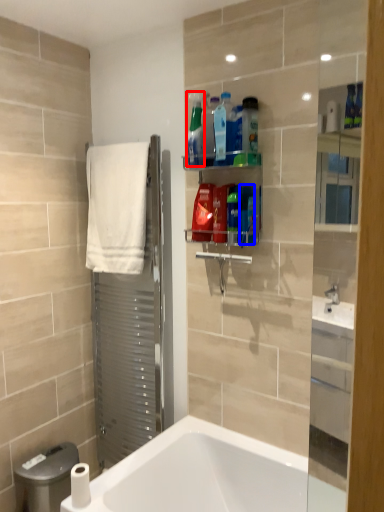
Question: Which object is closer to the camera taking this photo, cleaning product (highlighted by a red box) or cleaning product (highlighted by a blue box)?

Choices:
 (A) cleaning product
 (B) cleaning product

Answer: (B)